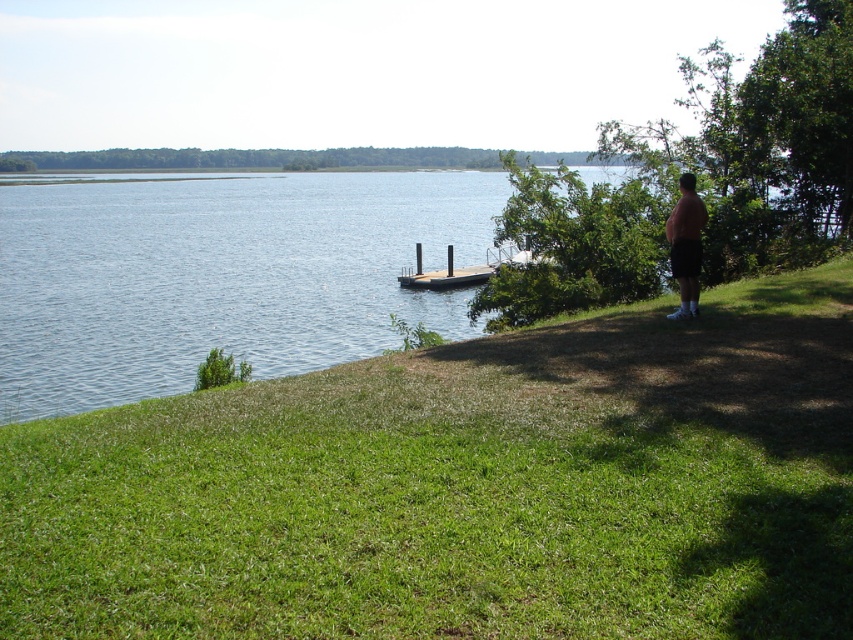
In order to click on green grassy at lower left in this screenshot , I will do `click(466, 488)`.

How distant is green grassy at lower left from wooden dock at center?

green grassy at lower left is 30.73 meters from wooden dock at center.

Is point (729, 582) closer to camera compared to point (410, 282)?

Yes, it is.

Locate an element on the screen. green grassy at lower left is located at coordinates (466, 488).

Who is lower down, pink cotton shirt at right or wooden dock at center?

pink cotton shirt at right is below.

Find the location of a particular element. The width and height of the screenshot is (853, 640). pink cotton shirt at right is located at coordinates (686, 244).

This screenshot has width=853, height=640. Identify the location of pink cotton shirt at right. (686, 244).

Describe the element at coordinates (466, 488) in the screenshot. I see `green grassy at lower left` at that location.

Is green grassy at lower left to the right of pink cotton shirt at right from the viewer's perspective?

Incorrect, green grassy at lower left is not on the right side of pink cotton shirt at right.

This screenshot has height=640, width=853. I want to click on green grassy at lower left, so click(x=466, y=488).

This screenshot has width=853, height=640. Identify the location of green grassy at lower left. (466, 488).